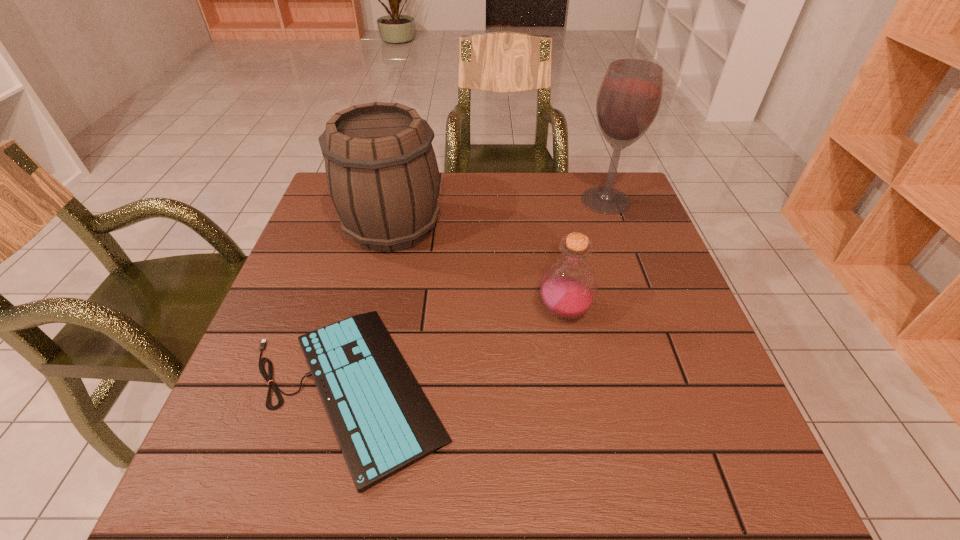
This screenshot has width=960, height=540. In the image, there is a desktop. What are the coordinates of `vacant space at the near edge` in the screenshot? It's located at (566, 487).

Find the location of a particular element. The height and width of the screenshot is (540, 960). vacant space at the left edge of the desktop is located at coordinates (291, 271).

The width and height of the screenshot is (960, 540). In the image, there is a desktop. What are the coordinates of `vacant space at the right edge` in the screenshot? It's located at (718, 382).

Image resolution: width=960 pixels, height=540 pixels. I want to click on vacant area at the near left corner of the desktop, so click(268, 496).

This screenshot has width=960, height=540. Find the location of `vacant space at the far right corner`. vacant space at the far right corner is located at coordinates (629, 199).

Locate an element on the screen. Image resolution: width=960 pixels, height=540 pixels. free space at the near right corner of the desktop is located at coordinates (710, 464).

Find the location of a particular element. vacant region between the alcohol and the shortest object is located at coordinates (477, 294).

This screenshot has height=540, width=960. What are the coordinates of `unoccupied position between the computer keyboard and the rightmost object` in the screenshot? It's located at (477, 294).

Image resolution: width=960 pixels, height=540 pixels. In order to click on free spot between the tallest object and the second tallest object in this screenshot , I will do `click(499, 214)`.

Where is `vacant space that is in between the second tallest object and the rightmost object`? This screenshot has height=540, width=960. vacant space that is in between the second tallest object and the rightmost object is located at coordinates (499, 214).